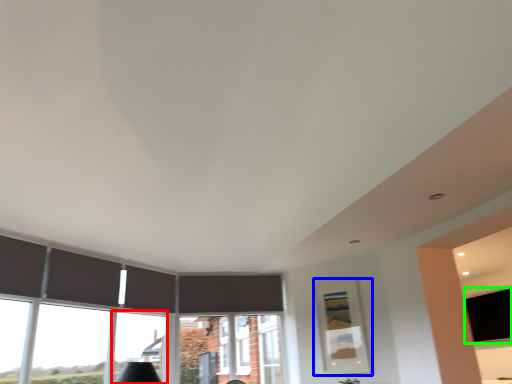
Question: Considering the real-world distances, which object is closest to window (highlighted by a red box)? picture frame (highlighted by a blue box) or window screen (highlighted by a green box).

Choices:
 (A) picture frame
 (B) window screen

Answer: (A)